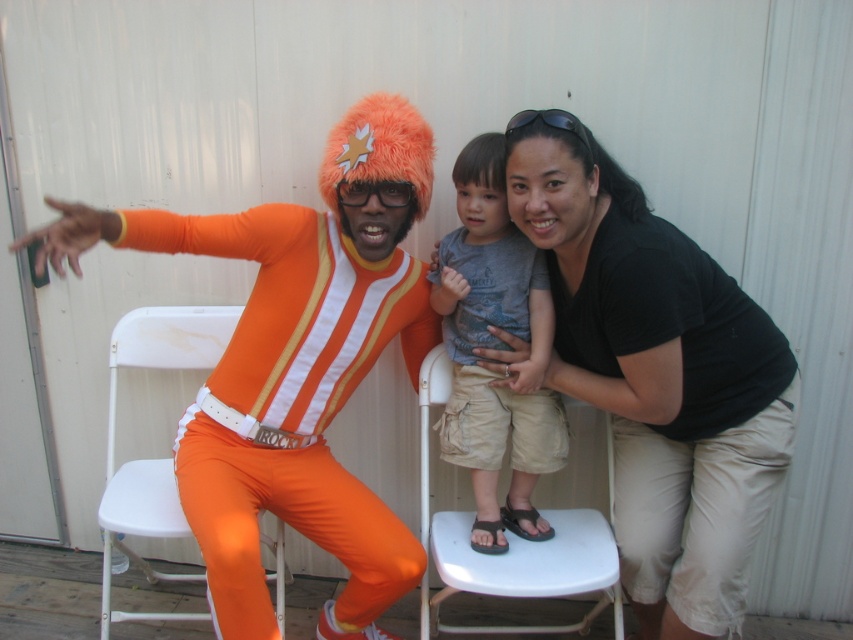
You are taking a photo of the three people in this scene. You want to focus on the point at point (x=367, y=604) and point (x=479, y=205). Which point is closer to the camera?

Point (x=367, y=604) is further to the camera than point (x=479, y=205), so point (x=479, y=205) is closer to the camera.

You are trying to take a photo of the black cotton shirt at upper right and the black plastic goggles at upper center. Which object should you focus on first if you want to capture both in the frame without moving the camera?

You should focus on the black plastic goggles at upper center first because the black cotton shirt at upper right is taller than the black plastic goggles at upper center, so it will naturally be in the frame when you focus on the lower object.

You are a photographer setting up for a group photo. You need to ensure that the orange spandex suit at left and the gray cotton shirt at center are both visible in the frame. Based on their heights, which person should stand on a stool to balance their visibility?

The gray cotton shirt at center should stand on a stool because the orange spandex suit at left is taller than the gray cotton shirt at center, so elevating the shorter person will balance their visibility.